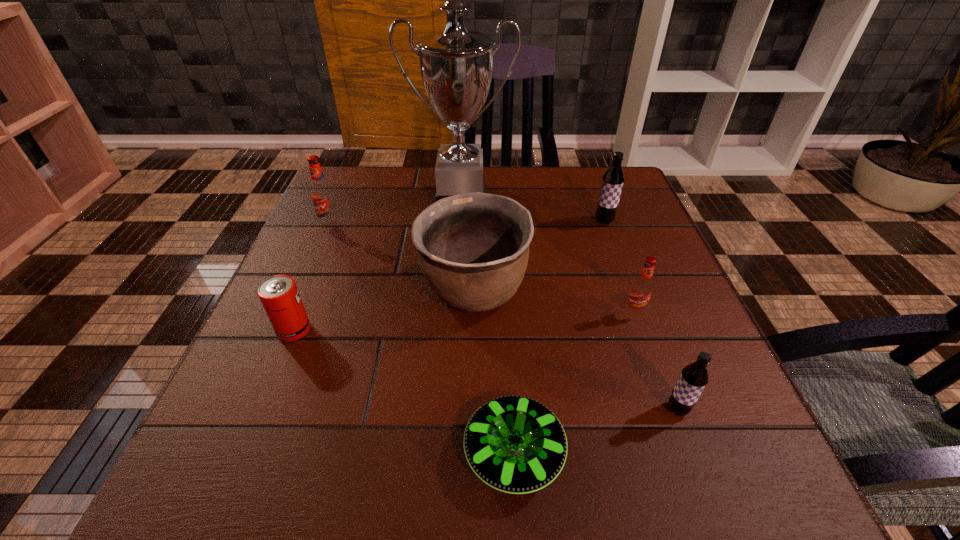
Where is `the tallest object`? the tallest object is located at coordinates (456, 65).

At what (x,y) coordinates should I click in order to perform the action: click on the farther brown root beer. Please return your answer as a coordinate pair (x, y). This screenshot has width=960, height=540. Looking at the image, I should click on (612, 181).

Locate an element on the screen. the leftmost root beer is located at coordinates (322, 195).

Find the location of a particular element. The width and height of the screenshot is (960, 540). the bigger red root beer is located at coordinates (322, 195).

The width and height of the screenshot is (960, 540). In order to click on pottery in this screenshot , I will do `click(473, 249)`.

This screenshot has width=960, height=540. In order to click on the second nearest root beer in this screenshot , I will do `click(641, 289)`.

Find the location of `the smaller red root beer`. the smaller red root beer is located at coordinates (641, 289).

The width and height of the screenshot is (960, 540). What are the coordinates of `the nearer brown root beer` in the screenshot? It's located at (694, 377).

This screenshot has height=540, width=960. What are the coordinates of `the smaller brown root beer` in the screenshot? It's located at (694, 377).

The height and width of the screenshot is (540, 960). Find the location of `the second shortest object`. the second shortest object is located at coordinates (279, 295).